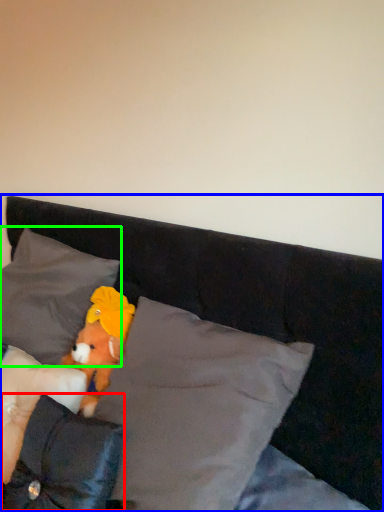
Question: Which object is positioned closest to pillow (highlighted by a red box)? Select from bed (highlighted by a blue box) and pillow (highlighted by a green box).

Choices:
 (A) bed
 (B) pillow

Answer: (B)